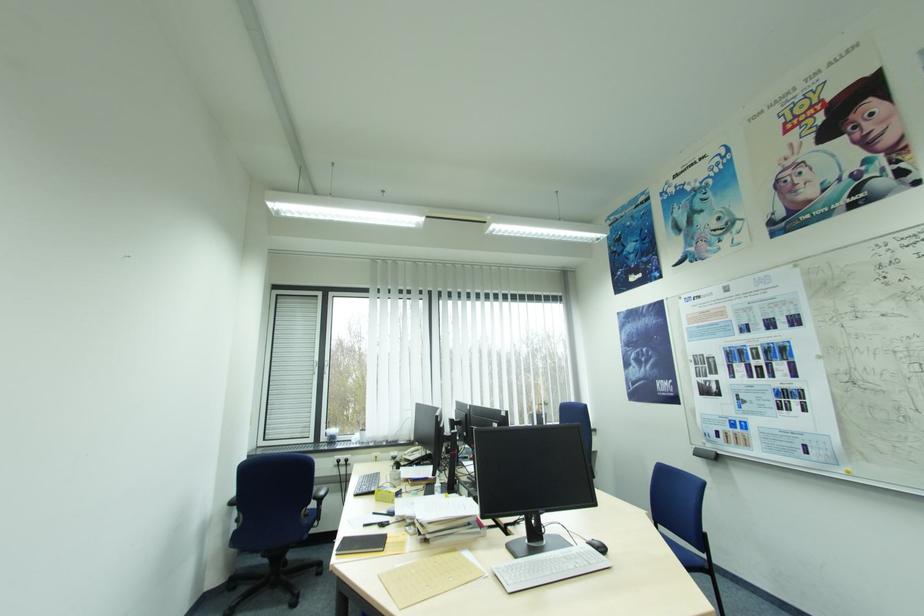
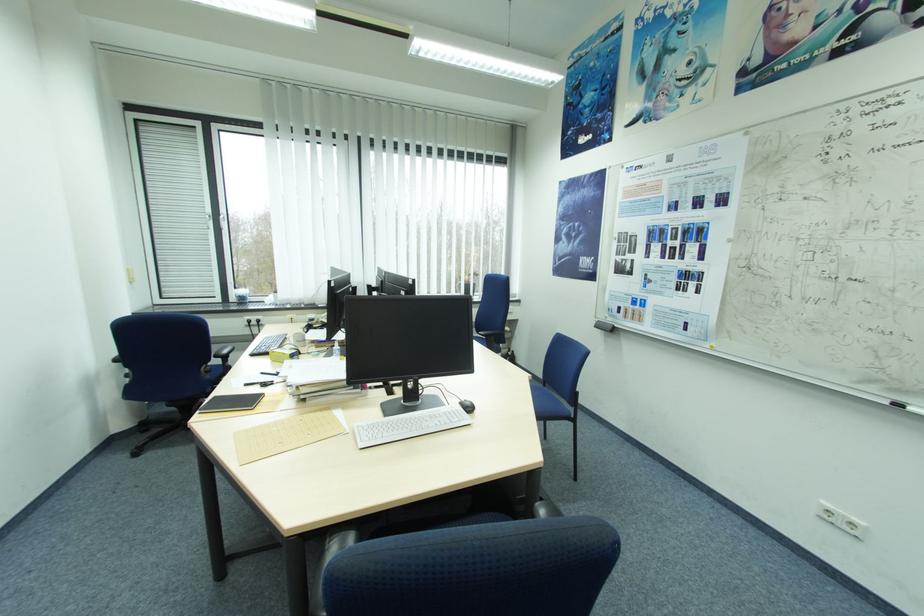
In a continuous first-person perspective shot, in which direction is the camera moving?

The cameraman walked toward right, forward.